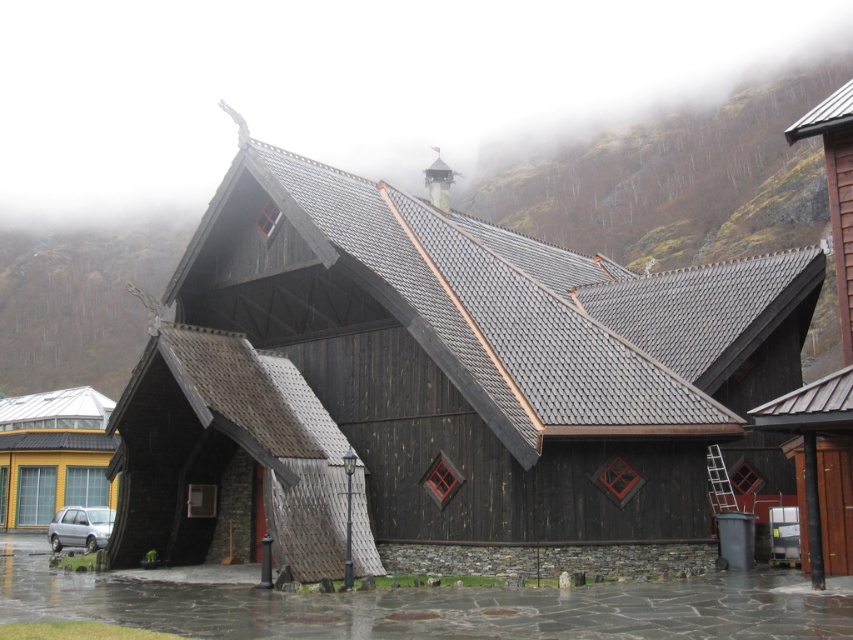
You are a photographer positioned at the center of the scene. You want to capture a photo where both the dark wood chapel at center and the silver metallic car at lower left are visible in the frame. Which direction should you face to ensure both objects are in your view?

You should face to the left to include both the dark wood chapel at center and the silver metallic car at lower left in your view because the dark wood chapel at center is to the right of the silver metallic car at lower left.

You are standing at the origin point of the coordinate system. You want to walk towards the dark wood chapel at center. Which direction should you walk?

The dark wood chapel at center is located at coordinate point 0.603 on the x axis and 0.515 on the y axis. Since you are at the origin point, you should walk towards the positive x and positive y directions to reach the dark wood chapel at center.

You are a photographer planning to take a wide shot of the dark wood chapel at center and the silver metallic car at lower left. Which object will appear larger in the photo?

The dark wood chapel at center will appear larger in the photo because it is much taller than the silver metallic car at lower left.